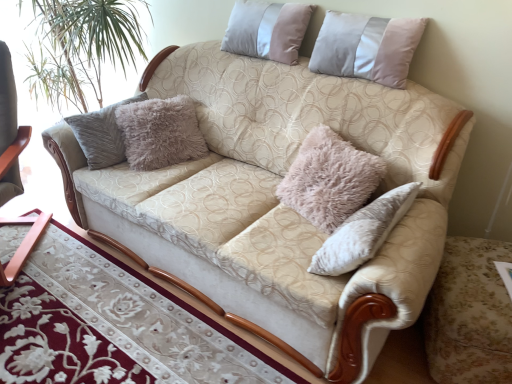
Question: Can you confirm if wooden table at lower left is wider than pale pink velvet pillow at upper right, marked as the second pillow in a left-to-right arrangement?

Choices:
 (A) no
 (B) yes

Answer: (B)

Question: Can you confirm if wooden table at lower left is smaller than pale pink velvet pillow at upper right, marked as the second pillow in a left-to-right arrangement?

Choices:
 (A) yes
 (B) no

Answer: (B)

Question: Are wooden table at lower left and pale pink velvet pillow at upper right, marked as the second pillow in a left-to-right arrangement, beside each other?

Choices:
 (A) no
 (B) yes

Answer: (A)

Question: Is wooden table at lower left positioned before pale pink velvet pillow at upper right, marked as the second pillow in a left-to-right arrangement?

Choices:
 (A) no
 (B) yes

Answer: (B)

Question: Does wooden table at lower left have a greater height compared to pale pink velvet pillow at upper right, marked as the second pillow in a left-to-right arrangement?

Choices:
 (A) yes
 (B) no

Answer: (B)

Question: Does point (6, 380) appear closer or farther from the camera than point (227, 36)?

Choices:
 (A) closer
 (B) farther

Answer: (A)

Question: Considering their positions, is wooden table at lower left located in front of or behind silky beige pillow at upper center, the first pillow viewed from the left?

Choices:
 (A) front
 (B) behind

Answer: (A)

Question: Considering the positions of wooden table at lower left and silky beige pillow at upper center, the first pillow viewed from the left, in the image, is wooden table at lower left bigger or smaller than silky beige pillow at upper center, the first pillow viewed from the left,?

Choices:
 (A) big
 (B) small

Answer: (A)

Question: Would you say wooden table at lower left is inside or outside silky beige pillow at upper center, placed as the second pillow when sorted from right to left?

Choices:
 (A) inside
 (B) outside

Answer: (B)

Question: Is silky beige pillow at upper center, the first pillow viewed from the left, situated inside pale pink velvet pillow at upper right, marked as the second pillow in a left-to-right arrangement, or outside?

Choices:
 (A) outside
 (B) inside

Answer: (A)

Question: Is silky beige pillow at upper center, the first pillow viewed from the left, in front of or behind pale pink velvet pillow at upper right, marked as the second pillow in a left-to-right arrangement, in the image?

Choices:
 (A) behind
 (B) front

Answer: (A)

Question: Considering the positions of silky beige pillow at upper center, the first pillow viewed from the left, and pale pink velvet pillow at upper right, marked as the second pillow in a left-to-right arrangement, in the image, is silky beige pillow at upper center, the first pillow viewed from the left, bigger or smaller than pale pink velvet pillow at upper right, marked as the second pillow in a left-to-right arrangement,?

Choices:
 (A) big
 (B) small

Answer: (B)

Question: Is silky beige pillow at upper center, the first pillow viewed from the left, wider or thinner than pale pink velvet pillow at upper right, marked as the first pillow in a right-to-left arrangement?

Choices:
 (A) thin
 (B) wide

Answer: (A)

Question: Looking at their shapes, would you say wooden rocking chair at left is wider or thinner than silky beige pillow at upper center, the first pillow viewed from the left?

Choices:
 (A) thin
 (B) wide

Answer: (B)

Question: In terms of size, does wooden rocking chair at left appear bigger or smaller than silky beige pillow at upper center, the first pillow viewed from the left?

Choices:
 (A) small
 (B) big

Answer: (B)